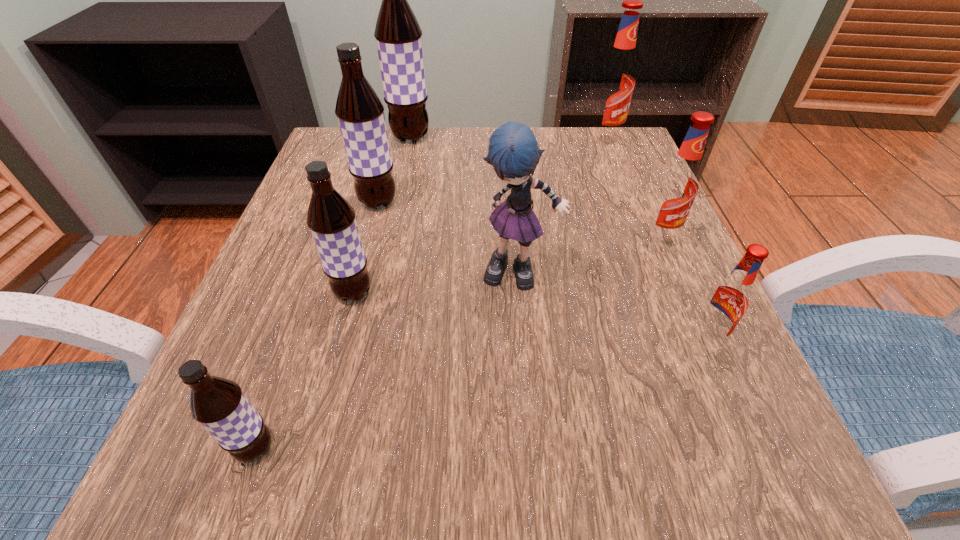
Image resolution: width=960 pixels, height=540 pixels. I want to click on the tallest object, so click(x=398, y=34).

This screenshot has width=960, height=540. I want to click on the biggest brown root beer, so [x=398, y=34].

Locate an element on the screen. the biggest red root beer is located at coordinates (616, 80).

Locate an element on the screen. the fifth nearest root beer is located at coordinates (360, 113).

Image resolution: width=960 pixels, height=540 pixels. Identify the location of the second biggest brown root beer. (360, 113).

The image size is (960, 540). I want to click on rag doll, so click(x=513, y=152).

The width and height of the screenshot is (960, 540). I want to click on blue rag doll, so click(513, 152).

Where is `the fourth farthest root beer`? the fourth farthest root beer is located at coordinates (676, 189).

At what (x,y) coordinates should I click in order to perform the action: click on the second biggest red root beer. Please return your answer as a coordinate pair (x, y). This screenshot has height=540, width=960. Looking at the image, I should click on (676, 189).

This screenshot has width=960, height=540. What are the coordinates of `the second nearest brown root beer` in the screenshot? It's located at (331, 219).